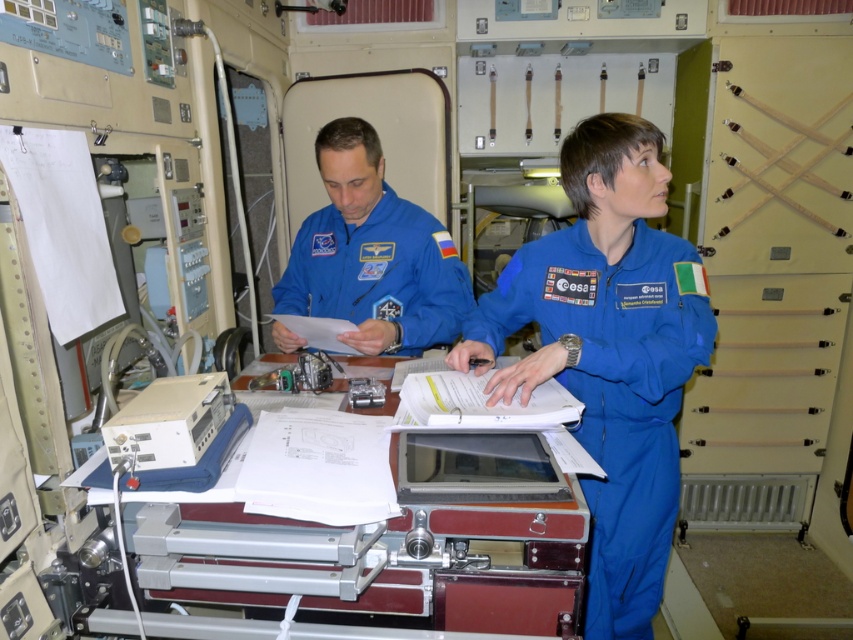
You are an astronaut in a space station. You need to locate the metallic silver printer at center and the blue fabric astronaut suit at center. From the perspective of the seated person on the left, which object is positioned to their right?

The metallic silver printer at center is to the right of the blue fabric astronaut suit at center. Since the seated person is facing forward, the metallic silver printer at center would be on their right side.

You are an astronaut in a space station. You need to locate the blue smooth jumpsuit at center. According to the coordinates given, where would you find it?

The blue smooth jumpsuit at center is located at coordinates point (608, 353).